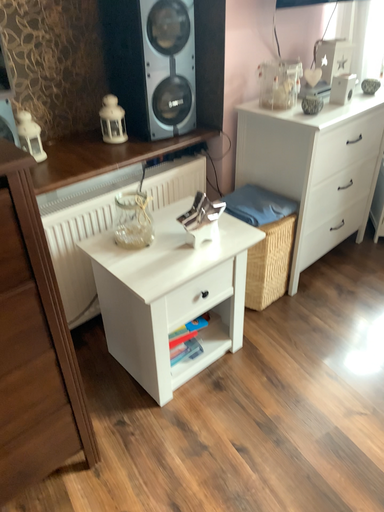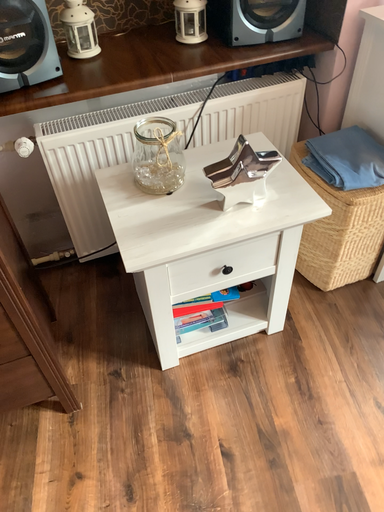
Question: How did the camera likely rotate when shooting the video?

Choices:
 (A) rotated right
 (B) rotated left

Answer: (B)